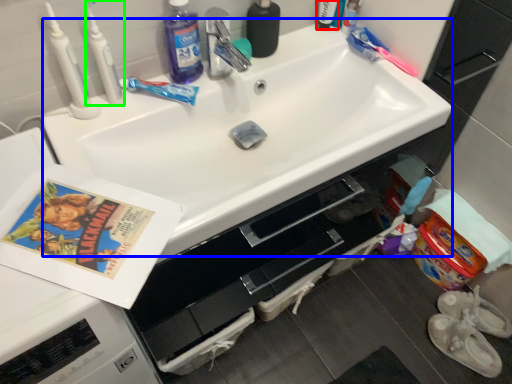
Question: Based on their relative distances, which object is nearer to toiletry (highlighted by a red box)? Choose from sink (highlighted by a blue box) and toothbrush (highlighted by a green box).

Choices:
 (A) sink
 (B) toothbrush

Answer: (A)